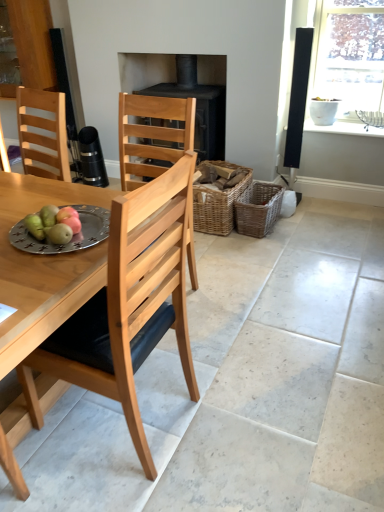
What do you see at coordinates (350, 54) in the screenshot?
I see `clear glass window at upper right` at bounding box center [350, 54].

What is the approximate height of woven brown basket at center-right, acting as the 1th basket starting from the right?

woven brown basket at center-right, acting as the 1th basket starting from the right, is 11.09 inches tall.

The height and width of the screenshot is (512, 384). What do you see at coordinates (128, 305) in the screenshot? I see `natural wood chair at center` at bounding box center [128, 305].

Identify the location of silver metallic plate at table left. Image resolution: width=384 pixels, height=512 pixels. (73, 236).

You are a GUI agent. You are given a task and a screenshot of the screen. Output one action in this format:
    pyautogui.click(x=<x>, y=<y>)
    Task: Click on the black matte fireplace at center
    
    Given the screenshot: What is the action you would take?
    pyautogui.click(x=198, y=102)

In the image, there is a silver metallic plate at table left. Identify the location of fireplace below it (from a real-world perspective). (198, 102).

Considering the sizes of silver metallic plate at table left and black matte fireplace at center in the image, is silver metallic plate at table left wider or thinner than black matte fireplace at center?

Clearly, silver metallic plate at table left has less width compared to black matte fireplace at center.

Which object is positioned more to the left, silver metallic plate at table left or black matte fireplace at center?

From the viewer's perspective, silver metallic plate at table left appears more on the left side.

Looking at this image, from the image's perspective, is silver metallic plate at table left positioned above or below black matte fireplace at center?

silver metallic plate at table left is below black matte fireplace at center.

Is woven brown basket at center, the 1th basket positioned from the left, situated inside silver metallic plate at table left or outside?

woven brown basket at center, the 1th basket positioned from the left, is outside silver metallic plate at table left.

The image size is (384, 512). Identify the location of the 1st basket behind the silver metallic plate at table left, starting your count from the anchor. (218, 204).

Is woven brown basket at center, the 1th basket positioned from the left, positioned far away from silver metallic plate at table left?

Yes, woven brown basket at center, the 1th basket positioned from the left, and silver metallic plate at table left are located far from each other.

Measure the distance between woven brown basket at center-right, acting as the 1th basket starting from the right, and clear glass window at upper right.

They are 1.14 meters apart.

Considering the positions of objects woven brown basket at center-right, arranged as the second basket when viewed from the left, and clear glass window at upper right in the image provided, who is more to the right, woven brown basket at center-right, arranged as the second basket when viewed from the left, or clear glass window at upper right?

clear glass window at upper right.

The image size is (384, 512). What are the coordinates of `window behind the woven brown basket at center-right, arranged as the second basket when viewed from the left` in the screenshot? It's located at (350, 54).

Is clear glass window at upper right inside woven brown basket at center-right, acting as the 1th basket starting from the right?

No, woven brown basket at center-right, acting as the 1th basket starting from the right, does not contain clear glass window at upper right.

Between clear glass window at upper right and black matte fireplace at center, which one is positioned behind?

black matte fireplace at center is further away from the camera.

Which point is more forward, (338, 93) or (175, 83)?

Point (338, 93)

Is clear glass window at upper right aimed at black matte fireplace at center?

No.

Is clear glass window at upper right not inside black matte fireplace at center?

Yes, clear glass window at upper right is outside of black matte fireplace at center.

Is green matte pears at table left facing away from woven brown basket at center, the 1th basket positioned from the left?

No, green matte pears at table left is not facing the opposite direction of woven brown basket at center, the 1th basket positioned from the left.

Considering the sizes of objects green matte pears at table left and woven brown basket at center, the 1th basket positioned from the left, in the image provided, who is smaller, green matte pears at table left or woven brown basket at center, the 1th basket positioned from the left,?

green matte pears at table left.

Between green matte pears at table left and woven brown basket at center, the 1th basket positioned from the left, which one appears on the right side from the viewer's perspective?

woven brown basket at center, the 1th basket positioned from the left.

Can you see green matte pears at table left touching woven brown basket at center, the 1th basket positioned from the left?

No, green matte pears at table left is not beside woven brown basket at center, the 1th basket positioned from the left.

Is natural wood chair at center positioned beyond the bounds of woven brown basket at center-right, acting as the 1th basket starting from the right?

That's correct, natural wood chair at center is outside of woven brown basket at center-right, acting as the 1th basket starting from the right.

Which is behind, natural wood chair at center or woven brown basket at center-right, acting as the 1th basket starting from the right?

woven brown basket at center-right, acting as the 1th basket starting from the right, is more distant.

From the image's perspective, which one is positioned lower, natural wood chair at center or woven brown basket at center-right, acting as the 1th basket starting from the right?

natural wood chair at center is shown below in the image.

Is natural wood chair at center bigger than woven brown basket at center-right, acting as the 1th basket starting from the right?

Yes, natural wood chair at center is bigger than woven brown basket at center-right, acting as the 1th basket starting from the right.

In the scene shown: Is black matte fireplace at center next to green matte pears at table left?

There is a gap between black matte fireplace at center and green matte pears at table left.

Is black matte fireplace at center to the right of green matte pears at table left from the viewer's perspective?

Correct, you'll find black matte fireplace at center to the right of green matte pears at table left.

From their relative heights in the image, would you say black matte fireplace at center is taller or shorter than green matte pears at table left?

black matte fireplace at center is taller than green matte pears at table left.

Locate an element on the screen. The image size is (384, 512). plate above the black matte fireplace at center (from a real-world perspective) is located at coordinates (73, 236).

Find the location of a particular element. the 1st basket directly beneath the silver metallic plate at table left (from a real-world perspective) is located at coordinates (218, 204).

Based on their spatial positions, is natural wood chair at center or clear glass window at upper right closer to woven brown basket at center-right, arranged as the second basket when viewed from the left?

Among the two, clear glass window at upper right is located nearer to woven brown basket at center-right, arranged as the second basket when viewed from the left.

From the image, which object appears to be nearer to clear glass window at upper right, natural wood chair at center or silver metallic plate at table left?

Based on the image, silver metallic plate at table left appears to be nearer to clear glass window at upper right.

Based on their spatial positions, is green matte pears at table left or woven brown basket at center, the 1th basket positioned from the left, further from clear glass window at upper right?

green matte pears at table left lies further to clear glass window at upper right than the other object.

Looking at the image, which one is located further to black matte fireplace at center, woven brown basket at center-right, arranged as the second basket when viewed from the left, or silver metallic plate at table left?

silver metallic plate at table left is positioned further to the anchor black matte fireplace at center.

When comparing their distances from clear glass window at upper right, does woven brown basket at center, the 1th basket positioned from the left, or green matte pears at table left seem closer?

Among the two, woven brown basket at center, the 1th basket positioned from the left, is located nearer to clear glass window at upper right.

Based on their spatial positions, is black matte fireplace at center or green matte pears at table left closer to silver metallic plate at table left?

green matte pears at table left is closer to silver metallic plate at table left.

Based on their spatial positions, is silver metallic plate at table left or woven brown basket at center, the 1th basket positioned from the left, further from green matte pears at table left?

woven brown basket at center, the 1th basket positioned from the left, is positioned further to the anchor green matte pears at table left.

Based on their spatial positions, is black matte fireplace at center or green matte pears at table left closer to woven brown basket at center-right, acting as the 1th basket starting from the right?

black matte fireplace at center lies closer to woven brown basket at center-right, acting as the 1th basket starting from the right, than the other object.

This screenshot has height=512, width=384. Identify the location of window between natural wood chair at center and black matte fireplace at center from front to back. (350, 54).

At what (x,y) coordinates should I click in order to perform the action: click on fruit positioned between natural wood chair at center and clear glass window at upper right from near to far. Please return your answer as a coordinate pair (x, y). This screenshot has height=512, width=384. Looking at the image, I should click on (35, 226).

Find the location of a particular element. The width and height of the screenshot is (384, 512). plate between natural wood chair at center and clear glass window at upper right in the front-back direction is located at coordinates (73, 236).

Locate an element on the screen. This screenshot has width=384, height=512. basket located between green matte pears at table left and woven brown basket at center-right, acting as the 1th basket starting from the right, in the depth direction is located at coordinates (218, 204).